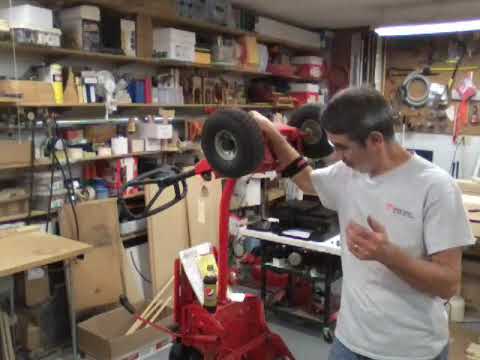
At what (x,y) coordinates should I click in order to perform the action: click on box. Please return your answer as a coordinate pair (x, y). Looking at the image, I should click on (40, 277).